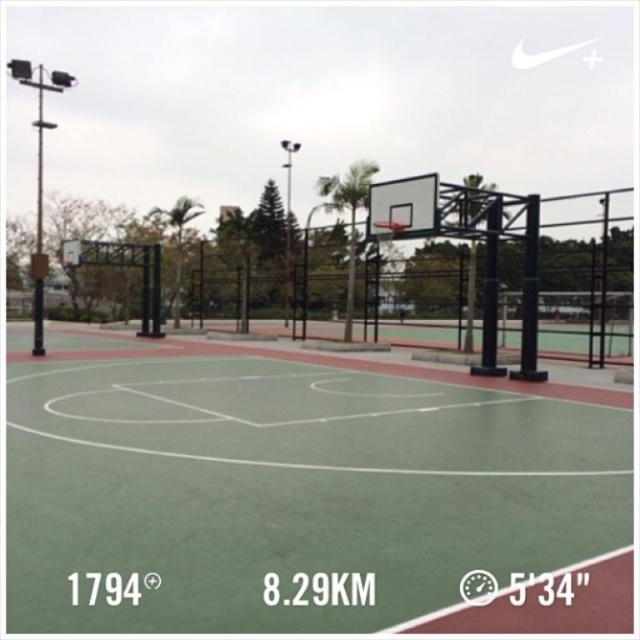
You are a maintenance worker checking the basketball court. You need to know if the green rubber basketball court at center is wider than the metallic silver basketball hoop at center. Can you confirm this?

The green rubber basketball court at center is wider than the metallic silver basketball basketball hoop at center according to the description.

You are a basketball player standing on the green rubber basketball court at center. You want to shoot a basketball into the metallic silver basketball hoop at center. Is the court positioned in a way that allows you to aim directly upwards towards the hoop?

The green rubber basketball court at center is positioned under the metallic silver basketball hoop at center, so yes, you can aim directly upwards towards the hoop since the court is directly beneath it.

You are standing at the origin point of the coordinate system. You want to walk to the green rubber basketball court at center. In which direction should you move?

The green rubber basketball court at center is located at coordinate point 0.767 on the x axis and 0.456 on the y axis. Since you are at the origin, you should move in the positive x and positive y direction to reach it.